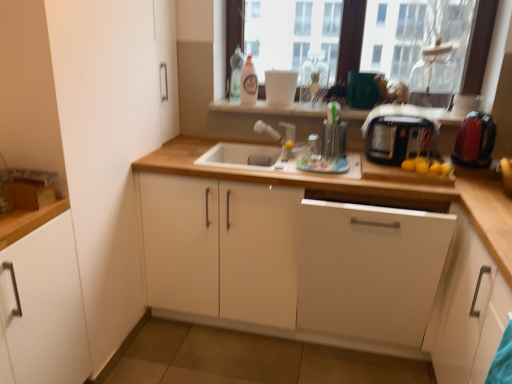
Question: From the image's perspective, is transparent glass window at upper center below satin nickel faucet at center?

Choices:
 (A) no
 (B) yes

Answer: (A)

Question: From the image's perspective, does transparent glass window at upper center appear higher than satin nickel faucet at center?

Choices:
 (A) no
 (B) yes

Answer: (B)

Question: Considering the relative positions of transparent glass window at upper center and satin nickel faucet at center in the image provided, is transparent glass window at upper center to the left of satin nickel faucet at center from the viewer's perspective?

Choices:
 (A) yes
 (B) no

Answer: (B)

Question: Is transparent glass window at upper center not within satin nickel faucet at center?

Choices:
 (A) no
 (B) yes

Answer: (B)

Question: Considering the relative sizes of transparent glass window at upper center and satin nickel faucet at center in the image provided, is transparent glass window at upper center smaller than satin nickel faucet at center?

Choices:
 (A) yes
 (B) no

Answer: (B)

Question: Considering the relative positions of white matte cabinet at left, which is the fifth cabinetry in right-to-left order, and black plastic toaster at right in the image provided, is white matte cabinet at left, which is the fifth cabinetry in right-to-left order, to the left or to the right of black plastic toaster at right?

Choices:
 (A) right
 (B) left

Answer: (B)

Question: Looking at the image, does white matte cabinet at left, which is the fifth cabinetry in right-to-left order, seem bigger or smaller compared to black plastic toaster at right?

Choices:
 (A) small
 (B) big

Answer: (B)

Question: From a real-world perspective, is white matte cabinet at left, which is counted as the 1th cabinetry, starting from the left, above or below black plastic toaster at right?

Choices:
 (A) above
 (B) below

Answer: (B)

Question: Is white matte cabinet at left, which is counted as the 1th cabinetry, starting from the left, wider or thinner than black plastic toaster at right?

Choices:
 (A) thin
 (B) wide

Answer: (B)

Question: Is black plastic toaster at right inside the boundaries of white matte cabinet at lower right, the fourth cabinetry in the left-to-right sequence, or outside?

Choices:
 (A) outside
 (B) inside

Answer: (A)

Question: Considering the positions of black plastic toaster at right and white matte cabinet at lower right, which ranks as the second cabinetry in right-to-left order, in the image, is black plastic toaster at right wider or thinner than white matte cabinet at lower right, which ranks as the second cabinetry in right-to-left order,?

Choices:
 (A) thin
 (B) wide

Answer: (B)

Question: Considering the positions of black plastic toaster at right and white matte cabinet at lower right, the fourth cabinetry in the left-to-right sequence, in the image, is black plastic toaster at right bigger or smaller than white matte cabinet at lower right, the fourth cabinetry in the left-to-right sequence,?

Choices:
 (A) small
 (B) big

Answer: (B)

Question: Does point (416, 147) appear closer or farther from the camera than point (477, 382)?

Choices:
 (A) farther
 (B) closer

Answer: (A)

Question: Is point (282, 137) closer or farther from the camera than point (74, 284)?

Choices:
 (A) farther
 (B) closer

Answer: (A)

Question: Considering the positions of satin nickel faucet at center and white matte cabinet at left, which is the fifth cabinetry in right-to-left order, in the image, is satin nickel faucet at center bigger or smaller than white matte cabinet at left, which is the fifth cabinetry in right-to-left order,?

Choices:
 (A) big
 (B) small

Answer: (B)